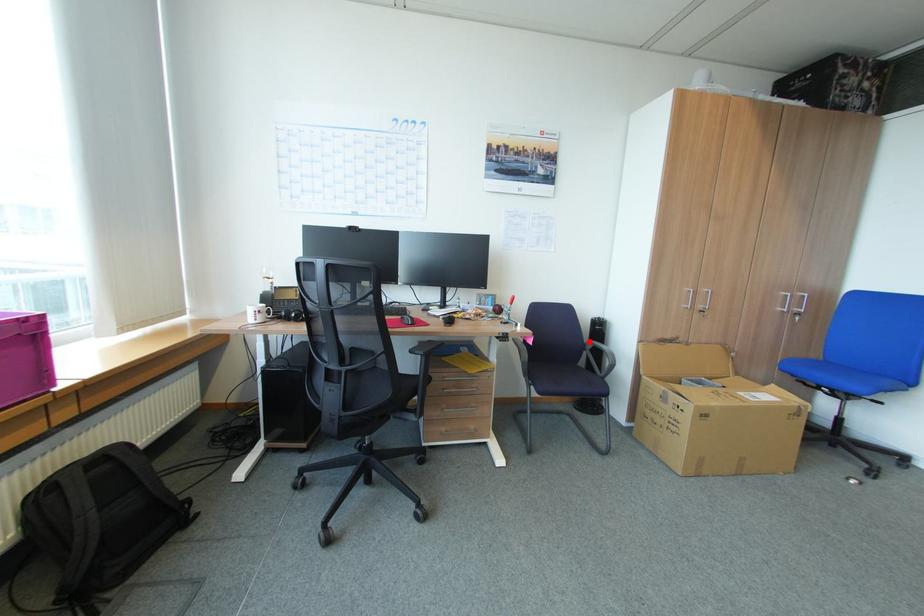
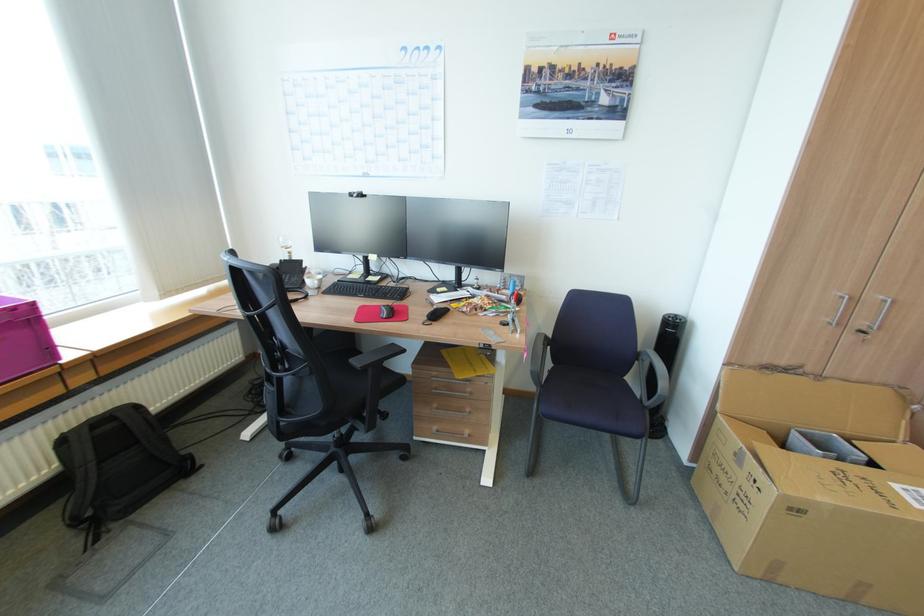
The point at the highlighted location is marked in the first image. Where is the corresponding point in the second image?

(643, 350)